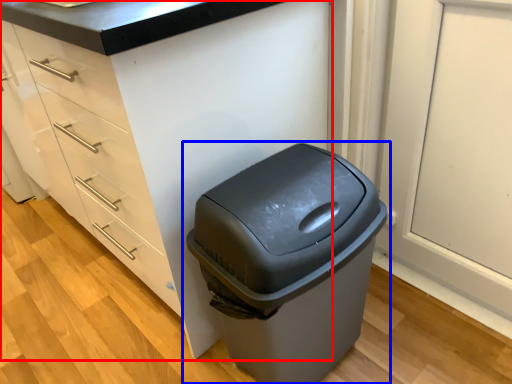
Question: Which point is further to the camera, cabinetry (highlighted by a red box) or waste container (highlighted by a blue box)?

Choices:
 (A) cabinetry
 (B) waste container

Answer: (B)